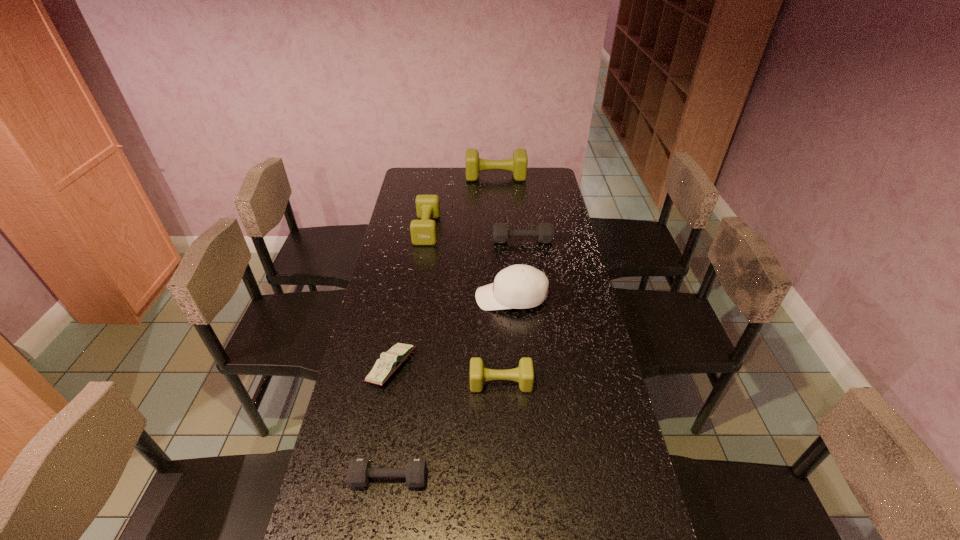
Identify the location of vacant area at the far right corner of the desktop. The height and width of the screenshot is (540, 960). (551, 191).

Find the location of `empty space between the farthest dumbbell and the second biggest olive dumbbell`. empty space between the farthest dumbbell and the second biggest olive dumbbell is located at coordinates (462, 203).

In order to click on free area in between the baseball cap and the nearest dumbbell in this screenshot , I will do `click(450, 388)`.

This screenshot has width=960, height=540. I want to click on vacant point located between the smallest olive dumbbell and the left gray dumbbell, so click(x=445, y=430).

I want to click on vacant region between the white baseball cap and the fourth farthest dumbbell, so click(x=506, y=340).

This screenshot has width=960, height=540. I want to click on empty location between the tallest dumbbell and the pink diary, so click(444, 272).

Locate an element on the screen. This screenshot has height=540, width=960. vacant space that's between the second smallest olive dumbbell and the diary is located at coordinates (409, 298).

You are a GUI agent. You are given a task and a screenshot of the screen. Output one action in this format:
    pyautogui.click(x=<x>, y=<y>)
    Task: Click on the free spot between the shortest object and the left gray dumbbell
    The width and height of the screenshot is (960, 540).
    Given the screenshot: What is the action you would take?
    pyautogui.click(x=391, y=422)

You are a GUI agent. You are given a task and a screenshot of the screen. Output one action in this format:
    pyautogui.click(x=<x>, y=<y>)
    Task: Click on the object that is the fourth closest to the right gray dumbbell
    
    Given the screenshot: What is the action you would take?
    pyautogui.click(x=388, y=363)

Image resolution: width=960 pixels, height=540 pixels. I want to click on the second closest object to the farther gray dumbbell, so click(x=423, y=232).